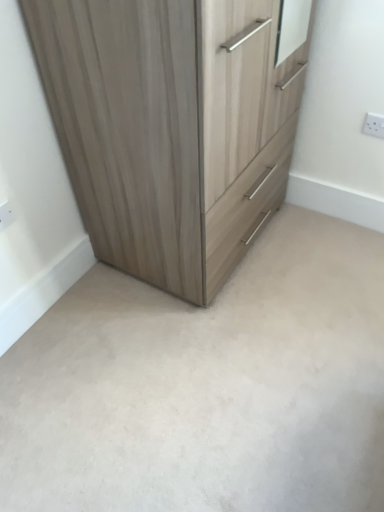
Question: From the image's perspective, is white plastic electric outlet at lower left, which is the 1th electric outlet in left-to-right order, beneath white plastic electric outlet at upper right, acting as the 1th electric outlet starting from the right?

Choices:
 (A) no
 (B) yes

Answer: (B)

Question: Is white plastic electric outlet at lower left, which is the 1th electric outlet in left-to-right order, positioned before white plastic electric outlet at upper right, which is counted as the second electric outlet, starting from the left?

Choices:
 (A) no
 (B) yes

Answer: (B)

Question: Considering the relative sizes of white plastic electric outlet at lower left, positioned as the 1th electric outlet in front-to-back order, and white plastic electric outlet at upper right, placed as the 2th electric outlet when sorted from bottom to top, in the image provided, is white plastic electric outlet at lower left, positioned as the 1th electric outlet in front-to-back order, smaller than white plastic electric outlet at upper right, placed as the 2th electric outlet when sorted from bottom to top,?

Choices:
 (A) no
 (B) yes

Answer: (B)

Question: Does white plastic electric outlet at lower left, which is the second electric outlet in back-to-front order, turn towards white plastic electric outlet at upper right, acting as the 1th electric outlet starting from the right?

Choices:
 (A) no
 (B) yes

Answer: (A)

Question: Is white plastic electric outlet at lower left, arranged as the 2th electric outlet when viewed from the right, positioned far away from white plastic electric outlet at upper right, the 2th electric outlet viewed from the front?

Choices:
 (A) yes
 (B) no

Answer: (A)

Question: From the image's perspective, is beige carpet at center positioned above or below white plastic electric outlet at upper right, the first electric outlet when ordered from back to front?

Choices:
 (A) above
 (B) below

Answer: (B)

Question: Looking at their shapes, would you say beige carpet at center is wider or thinner than white plastic electric outlet at upper right, the 2th electric outlet viewed from the front?

Choices:
 (A) thin
 (B) wide

Answer: (B)

Question: Is beige carpet at center in front of or behind white plastic electric outlet at upper right, the 2th electric outlet viewed from the front, in the image?

Choices:
 (A) front
 (B) behind

Answer: (A)

Question: Do you think beige carpet at center is within white plastic electric outlet at upper right, acting as the 1th electric outlet starting from the right, or outside of it?

Choices:
 (A) outside
 (B) inside

Answer: (A)

Question: Which is correct: white plastic electric outlet at upper right, placed as the 2th electric outlet when sorted from bottom to top, is inside white plastic electric outlet at lower left, arranged as the 2th electric outlet when viewed from the right, or outside of it?

Choices:
 (A) inside
 (B) outside

Answer: (B)

Question: Based on their sizes in the image, would you say white plastic electric outlet at upper right, the first electric outlet when ordered from back to front, is bigger or smaller than white plastic electric outlet at lower left, arranged as the 2th electric outlet when viewed from the right?

Choices:
 (A) big
 (B) small

Answer: (A)

Question: Does point (370, 132) appear closer or farther from the camera than point (8, 220)?

Choices:
 (A) farther
 (B) closer

Answer: (A)

Question: Is white plastic electric outlet at upper right, the first electric outlet when ordered from back to front, in front of or behind white plastic electric outlet at lower left, which is the second electric outlet in back-to-front order, in the image?

Choices:
 (A) front
 (B) behind

Answer: (B)

Question: In the image, is white plastic electric outlet at lower left, which is the 1th electric outlet in left-to-right order, positioned in front of or behind beige carpet at center?

Choices:
 (A) behind
 (B) front

Answer: (A)

Question: Is white plastic electric outlet at lower left, which is the second electric outlet in back-to-front order, to the left or to the right of beige carpet at center in the image?

Choices:
 (A) right
 (B) left

Answer: (B)